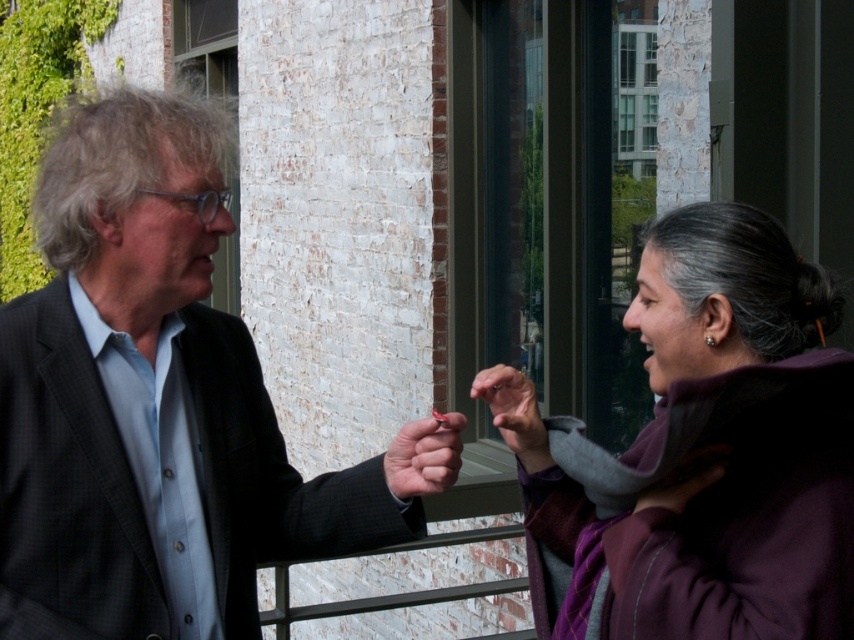
Question: Which point is closer to the camera?

Choices:
 (A) matte gray hand at center
 (B) purple woolen scarf at right
 (C) matte black suit at left

Answer: (B)

Question: Can you confirm if purple woolen scarf at right is bigger than matte gray hand at center?

Choices:
 (A) no
 (B) yes

Answer: (B)

Question: Which point is farther to the camera?

Choices:
 (A) (764, 364)
 (B) (38, 445)
 (C) (393, 492)
 (D) (512, 394)

Answer: (C)

Question: Can you confirm if matte black suit at left is positioned to the left of purple woolen scarf at right?

Choices:
 (A) yes
 (B) no

Answer: (A)

Question: Can you confirm if matte black hand at center is bigger than matte gray hand at center?

Choices:
 (A) yes
 (B) no

Answer: (B)

Question: Which point is farther to the camera?

Choices:
 (A) matte black suit at left
 (B) purple woolen scarf at right
 (C) matte black hand at center

Answer: (C)